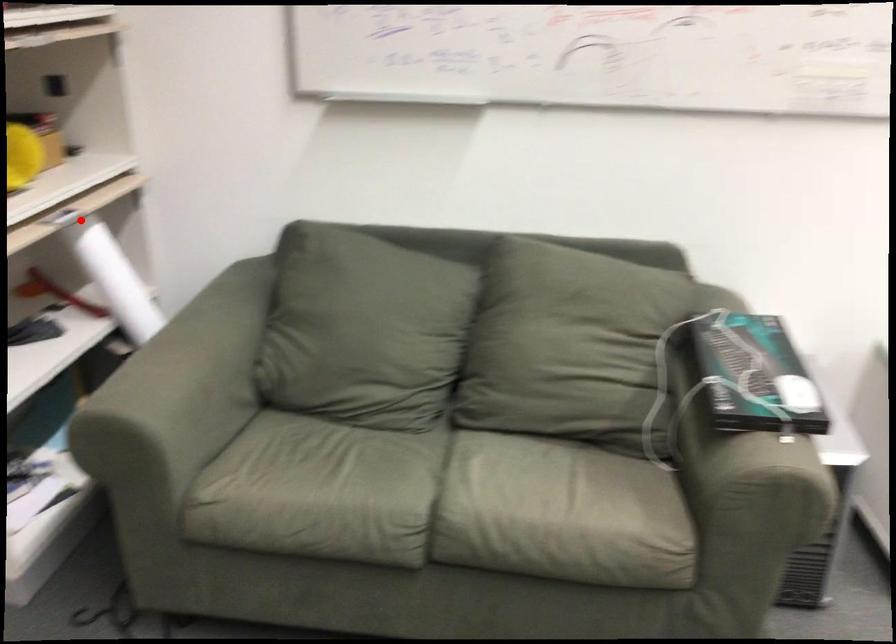
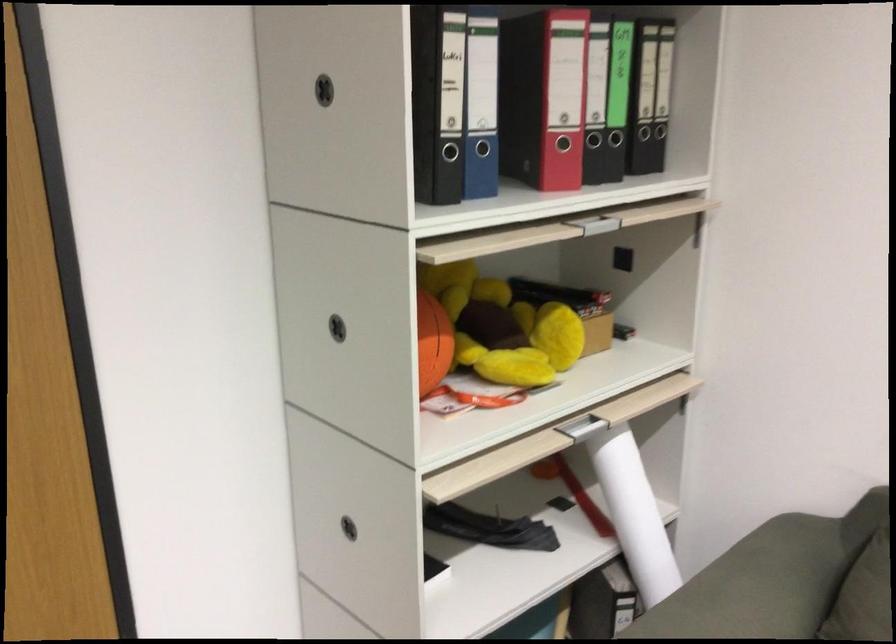
Question: I am providing you with two images of the same scene from different viewpoints. In image1, a red point is highlighted. Considering the same 3D point in image2, which of the following is correct?

Choices:
 (A) It is closer
 (B) It is farther

Answer: (A)